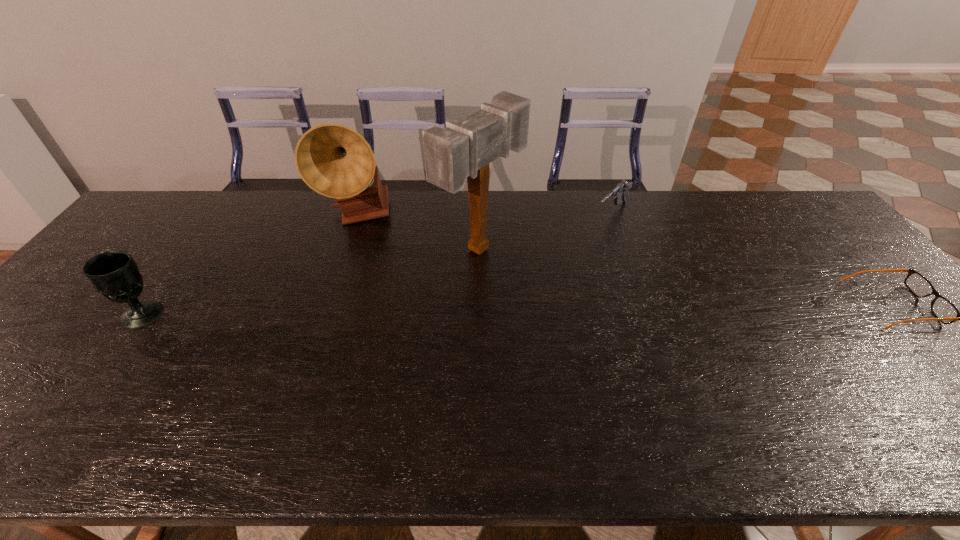
I want to click on vacant point located between the spectacles and the gun, so click(753, 259).

Find the location of a particular element. This screenshot has width=960, height=540. free space between the second object from right to left and the spectacles is located at coordinates (753, 259).

The height and width of the screenshot is (540, 960). I want to click on vacant area between the gun and the mallet, so (x=546, y=231).

Identify which object is located as the second nearest to the fourth tallest object. Please provide its 2D coordinates. Your answer should be formatted as a tuple, i.e. [(x, y)], where the tuple contains the x and y coordinates of a point satisfying the conditions above.

[(945, 311)]

I want to click on object that is the fourth nearest to the gun, so click(114, 274).

The image size is (960, 540). What are the coordinates of `vacant space that satisfies the following two spatial constraints: 1. on the front side of the spectacles; 2. on the front-facing side of the second object from left to right` in the screenshot? It's located at (332, 304).

I want to click on vacant area in the image that satisfies the following two spatial constraints: 1. on the back side of the shortest object; 2. on the front-facing side of the third shortest object, so click(x=151, y=304).